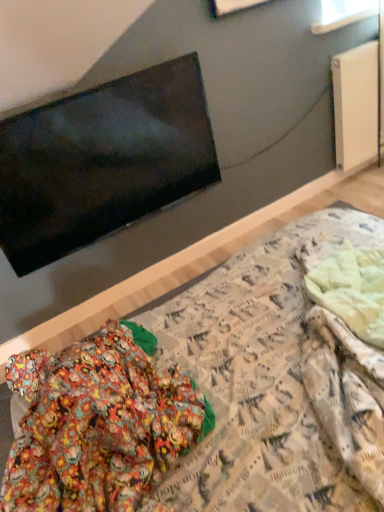
Locate an element on the screen. The image size is (384, 512). vacant area on top of flat matte black tv at upper left (from a real-world perspective) is located at coordinates (77, 90).